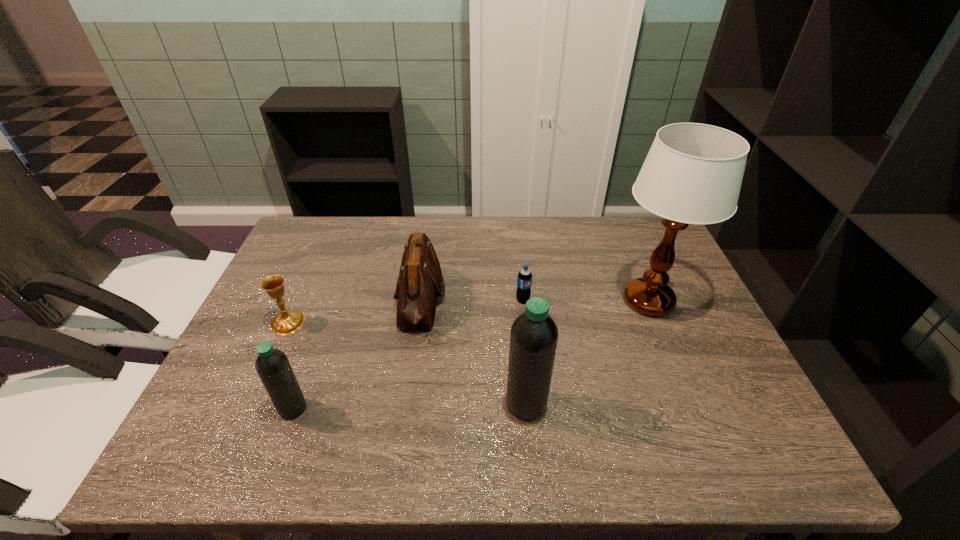
Point out which object is positioned as the third nearest to the right water bottle. Please provide its 2D coordinates. Your answer should be formatted as a tuple, i.e. [(x, y)], where the tuple contains the x and y coordinates of a point satisfying the conditions above.

[(693, 172)]

At what (x,y) coordinates should I click in order to perform the action: click on the closest object relative to the soda bottle. Please return your answer as a coordinate pair (x, y). Image resolution: width=960 pixels, height=540 pixels. Looking at the image, I should click on (420, 281).

Find the location of a particular element. free space that satisfies the following two spatial constraints: 1. on the front side of the third object from left to right; 2. on the left side of the soda bottle is located at coordinates (420, 300).

Where is `vacant space that satisfies the following two spatial constraints: 1. on the front side of the table lamp; 2. on the left side of the shortest object`? vacant space that satisfies the following two spatial constraints: 1. on the front side of the table lamp; 2. on the left side of the shortest object is located at coordinates (523, 301).

This screenshot has width=960, height=540. In order to click on vacant region that satisfies the following two spatial constraints: 1. on the back side of the shortest object; 2. on the left side of the shorter water bottle in this screenshot , I will do `click(332, 300)`.

Find the location of a particular element. This screenshot has width=960, height=540. vacant space that satisfies the following two spatial constraints: 1. on the back side of the chalice; 2. on the right side of the fourth object from right to left is located at coordinates (299, 298).